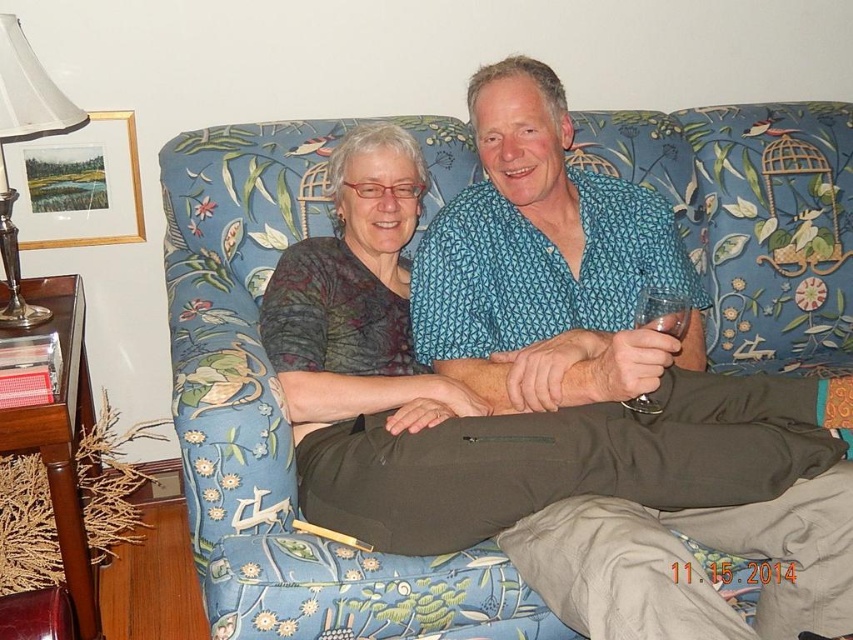
You are an interior designer assessing the living room layout. The blue printed shirt at center and the silver metallic lampshade at upper left are both in view. Which object takes up more visual space in the scene?

The blue printed shirt at center takes up more visual space in the scene as it is larger in size than the silver metallic lampshade at upper left.

You are designing a living room layout and want to place a 40 cm wide coffee table between the floral fabric couch at center and the silver metallic lampshade at upper left. Can the coffee table fit in the space between them?

The distance between the floral fabric couch at center and the silver metallic lampshade at upper left is 40.11 centimeters. Since the coffee table is 40 cm wide, it can fit in the space between them with a small gap of 0.11 centimeters remaining.